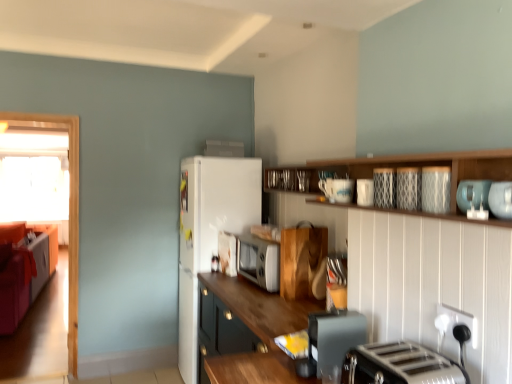
The width and height of the screenshot is (512, 384). I want to click on free space below transparent glass door at left (from a real-world perspective), so click(39, 379).